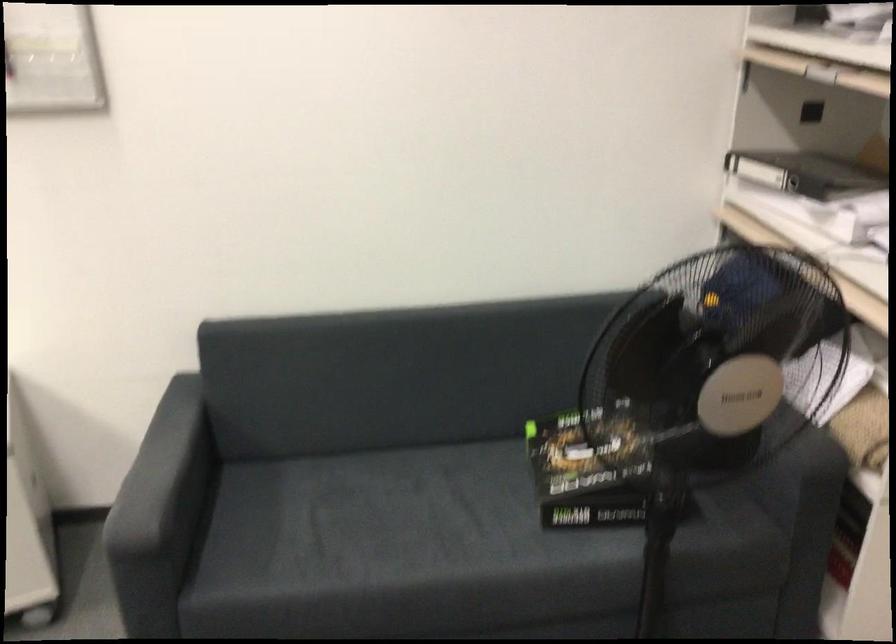
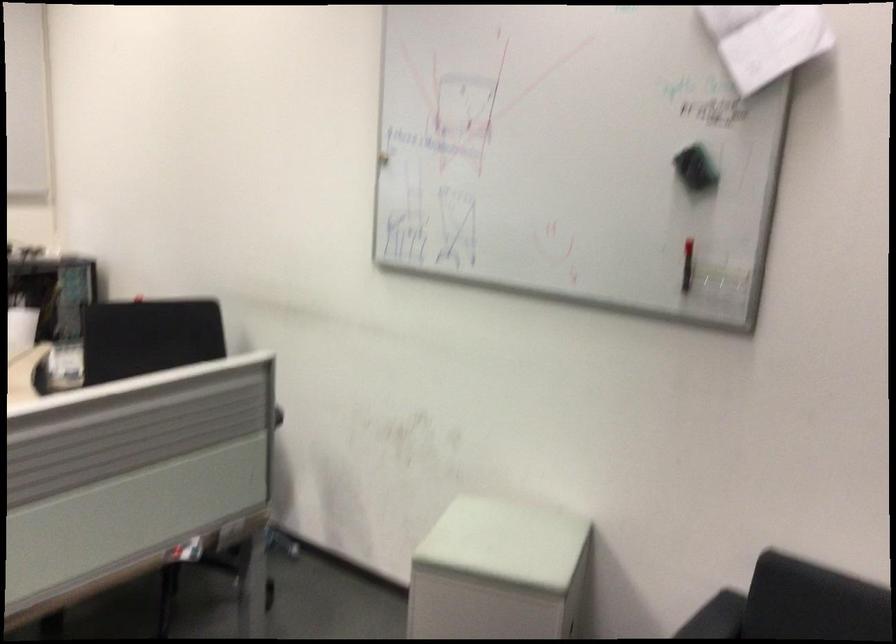
Question: The first image is from the beginning of the video and the second image is from the end. How did the camera likely rotate when shooting the video?

Choices:
 (A) Left
 (B) Right
 (C) Up
 (D) Down

Answer: (A)